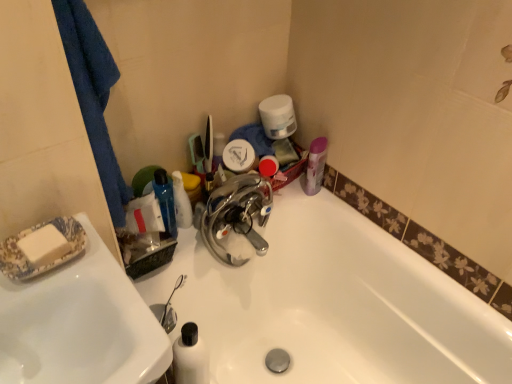
Question: Which is correct: white glossy bottle at upper center is inside white matte toilet paper at upper center, or outside of it?

Choices:
 (A) inside
 (B) outside

Answer: (B)

Question: Is white glossy bottle at upper center bigger or smaller than white matte toilet paper at upper center?

Choices:
 (A) small
 (B) big

Answer: (A)

Question: Which object is the closest to the blue fabric towel at left?

Choices:
 (A) white glossy sink at left
 (B) white glossy bottle at upper center
 (C) white matte toilet paper at upper center

Answer: (A)

Question: Which is farther from the blue fabric towel at left?

Choices:
 (A) white glossy sink at left
 (B) white glossy bottle at upper center
 (C) white matte toilet paper at upper center

Answer: (C)